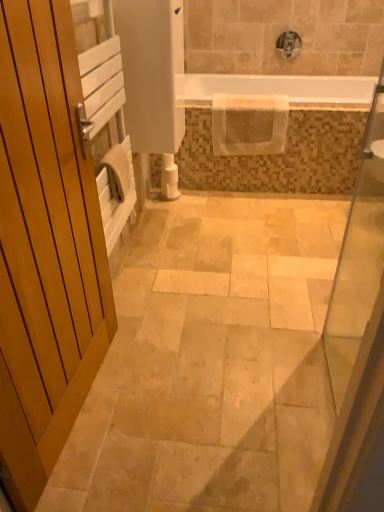
Question: Is the surface of white matte toilet paper at center in direct contact with white textured towel at upper center?

Choices:
 (A) no
 (B) yes

Answer: (A)

Question: From the image's perspective, is white matte toilet paper at center beneath white textured towel at upper center?

Choices:
 (A) yes
 (B) no

Answer: (A)

Question: Does white matte toilet paper at center have a lesser width compared to white textured towel at upper center?

Choices:
 (A) no
 (B) yes

Answer: (B)

Question: Is white matte toilet paper at center facing away from white textured towel at upper center?

Choices:
 (A) yes
 (B) no

Answer: (B)

Question: Would you say white matte toilet paper at center contains white textured towel at upper center?

Choices:
 (A) no
 (B) yes

Answer: (A)

Question: Is transparent glass door at right in front of or behind satin nickel faucet at upper center in the image?

Choices:
 (A) behind
 (B) front

Answer: (B)

Question: From a real-world perspective, relative to satin nickel faucet at upper center, is transparent glass door at right vertically above or below?

Choices:
 (A) above
 (B) below

Answer: (B)

Question: Is transparent glass door at right bigger or smaller than satin nickel faucet at upper center?

Choices:
 (A) small
 (B) big

Answer: (B)

Question: In terms of height, does transparent glass door at right look taller or shorter compared to satin nickel faucet at upper center?

Choices:
 (A) short
 (B) tall

Answer: (B)

Question: Based on their sizes in the image, would you say satin nickel faucet at upper center is bigger or smaller than transparent glass door at right?

Choices:
 (A) small
 (B) big

Answer: (A)

Question: From a real-world perspective, is satin nickel faucet at upper center positioned above or below transparent glass door at right?

Choices:
 (A) above
 (B) below

Answer: (A)

Question: Based on their positions, is satin nickel faucet at upper center located to the left or right of transparent glass door at right?

Choices:
 (A) right
 (B) left

Answer: (A)

Question: Relative to transparent glass door at right, is satin nickel faucet at upper center in front or behind?

Choices:
 (A) behind
 (B) front

Answer: (A)

Question: In terms of width, does white matte toilet paper at center look wider or thinner when compared to transparent glass door at right?

Choices:
 (A) wide
 (B) thin

Answer: (A)

Question: From their relative heights in the image, would you say white matte toilet paper at center is taller or shorter than transparent glass door at right?

Choices:
 (A) short
 (B) tall

Answer: (A)